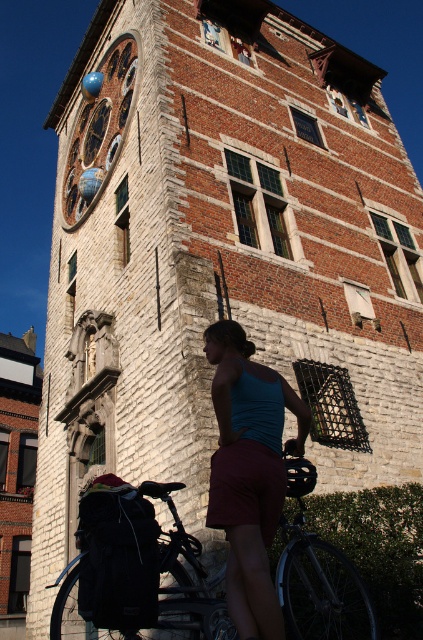
Question: Among these objects, which one is nearest to the camera?

Choices:
 (A) teal fabric tank top at center
 (B) blue glass clock at upper left

Answer: (A)

Question: Which object is closer to the camera taking this photo?

Choices:
 (A) blue glass clock at upper left
 (B) teal fabric tank top at center
 (C) black matte bicycle at lower center

Answer: (B)

Question: Which point is farther to the camera?

Choices:
 (A) black matte bicycle at lower center
 (B) blue glass clock at upper left

Answer: (B)

Question: Can you confirm if black matte bicycle at lower center is positioned to the left of blue glass clock at upper left?

Choices:
 (A) no
 (B) yes

Answer: (A)

Question: Is black matte bicycle at lower center below teal fabric tank top at center?

Choices:
 (A) no
 (B) yes

Answer: (B)

Question: Does black matte bicycle at lower center lie in front of blue glass clock at upper left?

Choices:
 (A) yes
 (B) no

Answer: (A)